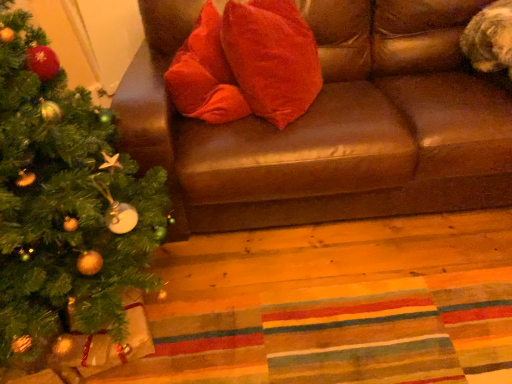
Question: Is brown leather couch at upper center inside green matte christmas tree at left?

Choices:
 (A) yes
 (B) no

Answer: (B)

Question: Could you tell me if green matte christmas tree at left is turned towards brown leather couch at upper center?

Choices:
 (A) yes
 (B) no

Answer: (B)

Question: Does green matte christmas tree at left have a smaller size compared to brown leather couch at upper center?

Choices:
 (A) no
 (B) yes

Answer: (B)

Question: Considering the relative positions of green matte christmas tree at left and brown leather couch at upper center in the image provided, is green matte christmas tree at left behind brown leather couch at upper center?

Choices:
 (A) yes
 (B) no

Answer: (B)

Question: Is green matte christmas tree at left shorter than brown leather couch at upper center?

Choices:
 (A) yes
 (B) no

Answer: (B)

Question: From a real-world perspective, is green matte christmas tree at left positioned over brown leather couch at upper center based on gravity?

Choices:
 (A) no
 (B) yes

Answer: (B)

Question: From a real-world perspective, is green matte christmas tree at left positioned under velvet red pillow at center based on gravity?

Choices:
 (A) no
 (B) yes

Answer: (B)

Question: Does green matte christmas tree at left have a greater height compared to velvet red pillow at center?

Choices:
 (A) no
 (B) yes

Answer: (B)

Question: Does green matte christmas tree at left appear on the right side of velvet red pillow at center?

Choices:
 (A) no
 (B) yes

Answer: (A)

Question: Does green matte christmas tree at left have a smaller size compared to velvet red pillow at center?

Choices:
 (A) yes
 (B) no

Answer: (B)

Question: Does green matte christmas tree at left appear on the left side of velvet red pillow at center?

Choices:
 (A) yes
 (B) no

Answer: (A)

Question: Considering the relative sizes of green matte christmas tree at left and velvet red pillow at center in the image provided, is green matte christmas tree at left thinner than velvet red pillow at center?

Choices:
 (A) no
 (B) yes

Answer: (A)

Question: Is brown leather couch at upper center oriented away from green matte christmas tree at left?

Choices:
 (A) no
 (B) yes

Answer: (A)